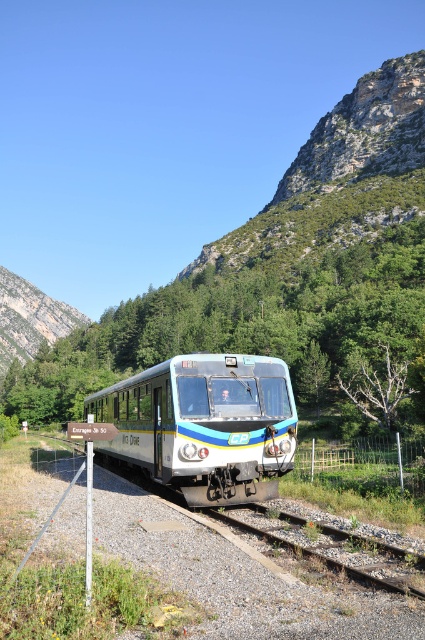
I want to click on metallic silver train at center, so click(x=204, y=424).

Who is positioned more to the left, metallic silver train at center or brown gravel train track at lower center?

metallic silver train at center is more to the left.

The height and width of the screenshot is (640, 425). I want to click on metallic silver train at center, so click(204, 424).

Can you confirm if metallic silver train at center is positioned above rugged stone mountain at upper left?

No, metallic silver train at center is not above rugged stone mountain at upper left.

Does metallic silver train at center have a larger size compared to rugged stone mountain at upper left?

No.

The image size is (425, 640). I want to click on metallic silver train at center, so click(x=204, y=424).

Which of these two, brown gravel train track at lower center or rugged stone mountain at upper left, stands shorter?

brown gravel train track at lower center is shorter.

Who is taller, brown gravel train track at lower center or rugged stone mountain at upper left?

Standing taller between the two is rugged stone mountain at upper left.

In order to click on brown gravel train track at lower center in this screenshot , I will do `click(334, 545)`.